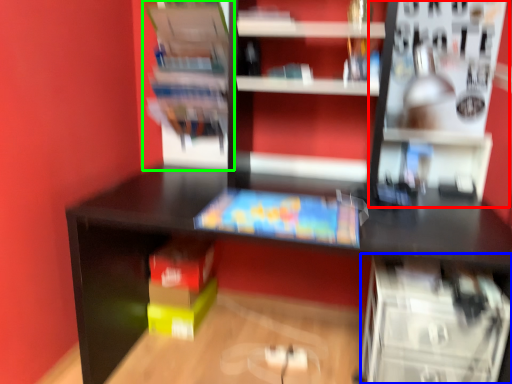
Question: Which object is the closest to the shelf (highlighted by a red box)? Choose among these: shelf (highlighted by a blue box) or shelf (highlighted by a green box).

Choices:
 (A) shelf
 (B) shelf

Answer: (A)